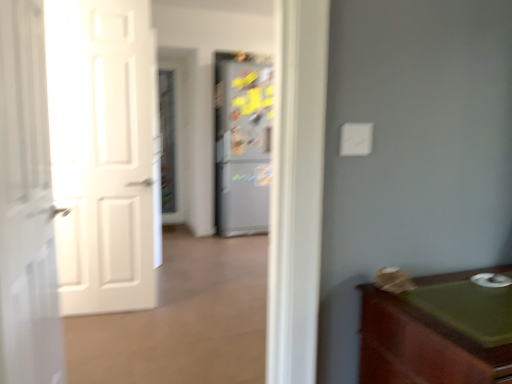
Question: Is green wood cabinet at lower right thinner than metallic gray refrigerator at center?

Choices:
 (A) no
 (B) yes

Answer: (B)

Question: Can you confirm if green wood cabinet at lower right is positioned to the left of metallic gray refrigerator at center?

Choices:
 (A) no
 (B) yes

Answer: (A)

Question: Is the position of green wood cabinet at lower right less distant than that of metallic gray refrigerator at center?

Choices:
 (A) yes
 (B) no

Answer: (A)

Question: Are green wood cabinet at lower right and metallic gray refrigerator at center making contact?

Choices:
 (A) yes
 (B) no

Answer: (B)

Question: Is green wood cabinet at lower right at the right side of metallic gray refrigerator at center?

Choices:
 (A) yes
 (B) no

Answer: (A)

Question: In the image, is metallic gray refrigerator at center on the left side or the right side of white glossy door at left, the 1th door viewed from the front?

Choices:
 (A) left
 (B) right

Answer: (B)

Question: From a real-world perspective, is metallic gray refrigerator at center positioned above or below white glossy door at left, the 1th door viewed from the front?

Choices:
 (A) above
 (B) below

Answer: (A)

Question: Relative to white glossy door at left, positioned as the second door in back-to-front order, is metallic gray refrigerator at center in front or behind?

Choices:
 (A) behind
 (B) front

Answer: (A)

Question: In terms of width, does metallic gray refrigerator at center look wider or thinner when compared to white glossy door at left, positioned as the second door in back-to-front order?

Choices:
 (A) wide
 (B) thin

Answer: (A)

Question: From the image's perspective, is clear glass screen door at center above or below white glossy door at left, positioned as the second door in back-to-front order?

Choices:
 (A) above
 (B) below

Answer: (A)

Question: Is clear glass screen door at center wider or thinner than white glossy door at left, positioned as the second door in back-to-front order?

Choices:
 (A) thin
 (B) wide

Answer: (A)

Question: In terms of size, does clear glass screen door at center appear bigger or smaller than white glossy door at left, the 1th door viewed from the front?

Choices:
 (A) big
 (B) small

Answer: (B)

Question: Based on their positions, is clear glass screen door at center located to the left or right of white glossy door at left, positioned as the second door in back-to-front order?

Choices:
 (A) right
 (B) left

Answer: (B)

Question: Considering the positions of white glossy door at left, positioned as the second door in back-to-front order, and green wood cabinet at lower right in the image, is white glossy door at left, positioned as the second door in back-to-front order, taller or shorter than green wood cabinet at lower right?

Choices:
 (A) tall
 (B) short

Answer: (A)

Question: From a real-world perspective, is white glossy door at left, the 1th door viewed from the front, above or below green wood cabinet at lower right?

Choices:
 (A) above
 (B) below

Answer: (A)